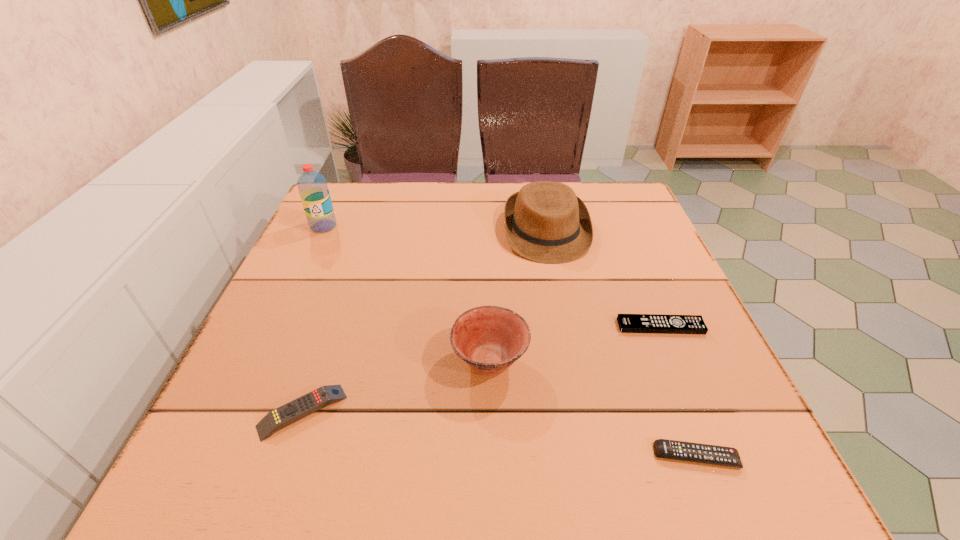
The image size is (960, 540). What are the coordinates of `free spot that satisfies the following two spatial constraints: 1. on the front label of the leftmost object; 2. on the right side of the farthest remote control` in the screenshot? It's located at (276, 326).

Where is `vacant space that satisfies the following two spatial constraints: 1. on the front-facing side of the fedora; 2. on the right side of the farthest remote control`? vacant space that satisfies the following two spatial constraints: 1. on the front-facing side of the fedora; 2. on the right side of the farthest remote control is located at coordinates (564, 326).

Where is `blank area in the image that satisfies the following two spatial constraints: 1. on the front-facing side of the nearest object; 2. on the right side of the fedora`? This screenshot has width=960, height=540. blank area in the image that satisfies the following two spatial constraints: 1. on the front-facing side of the nearest object; 2. on the right side of the fedora is located at coordinates (590, 456).

Where is `free point that satisfies the following two spatial constraints: 1. on the front-facing side of the fedora; 2. on the left side of the farthest remote control`? free point that satisfies the following two spatial constraints: 1. on the front-facing side of the fedora; 2. on the left side of the farthest remote control is located at coordinates (564, 326).

Where is `free spot that satisfies the following two spatial constraints: 1. on the front label of the nearest remote control; 2. on the left side of the water bottle`? The width and height of the screenshot is (960, 540). free spot that satisfies the following two spatial constraints: 1. on the front label of the nearest remote control; 2. on the left side of the water bottle is located at coordinates (216, 456).

Locate an element on the screen. This screenshot has height=540, width=960. vacant position in the image that satisfies the following two spatial constraints: 1. on the front label of the leftmost remote control; 2. on the right side of the leftmost object is located at coordinates (237, 411).